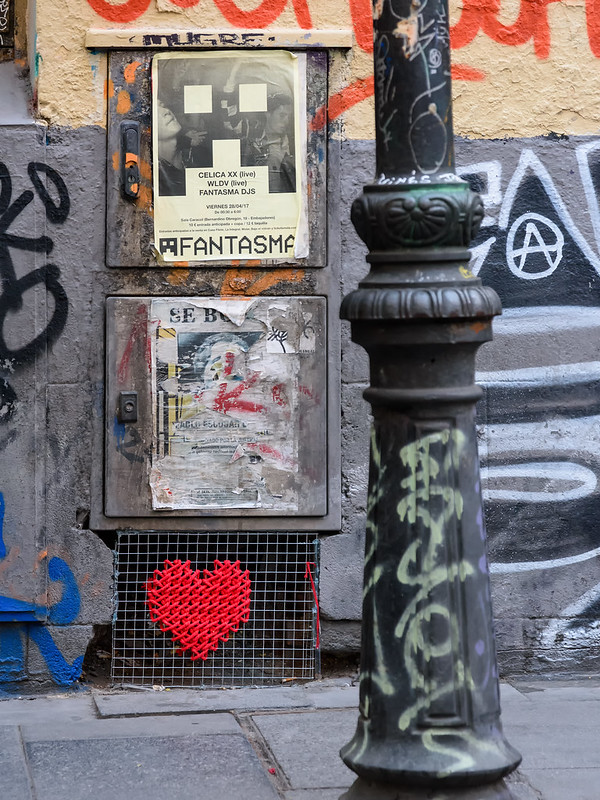
Locate an element on the screen. door is located at coordinates (130, 406), (129, 174).